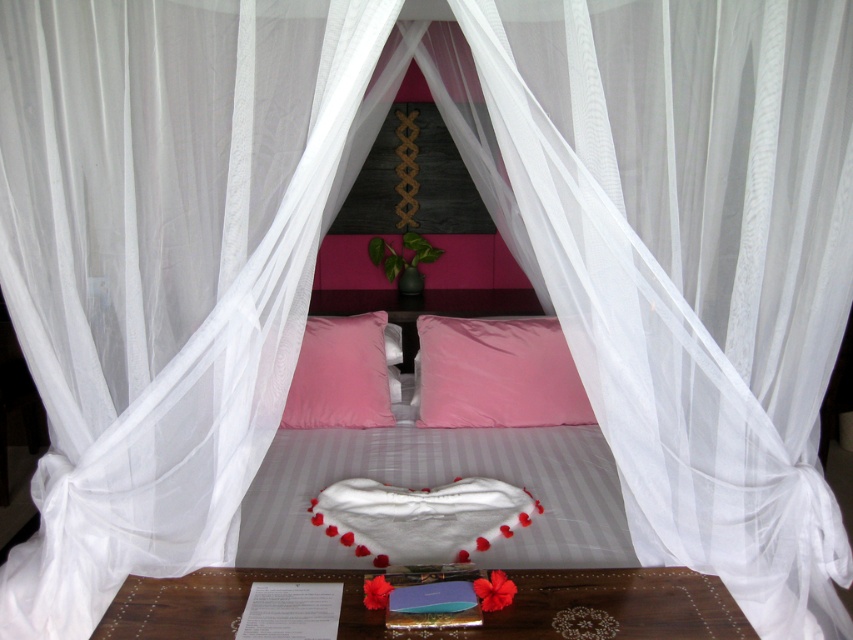
You are organizing a romantic evening in the bedroom scene. You have a wooden tray at lower center and a white fluffy heart at center. Which object can hold more items, and why?

The white fluffy heart at center can hold more items because it is larger in size compared to the wooden tray at lower center.

You are arranging flowers in the bedroom and need to place a vase between the pink velvet pillows at center and the pink matte pillow at center. According to their positions, which pillow should the vase be closer to?

The vase should be placed closer to the pink velvet pillows at center since it is positioned to the left of the pink matte pillow at center.

You are standing at the entrance of the bedroom and want to place a new decorative item on the pink velvet pillows at center. According to the coordinates provided, where exactly should you place the item?

The pink velvet pillows at center are located at coordinates point (440, 483), so you should place the decorative item there.